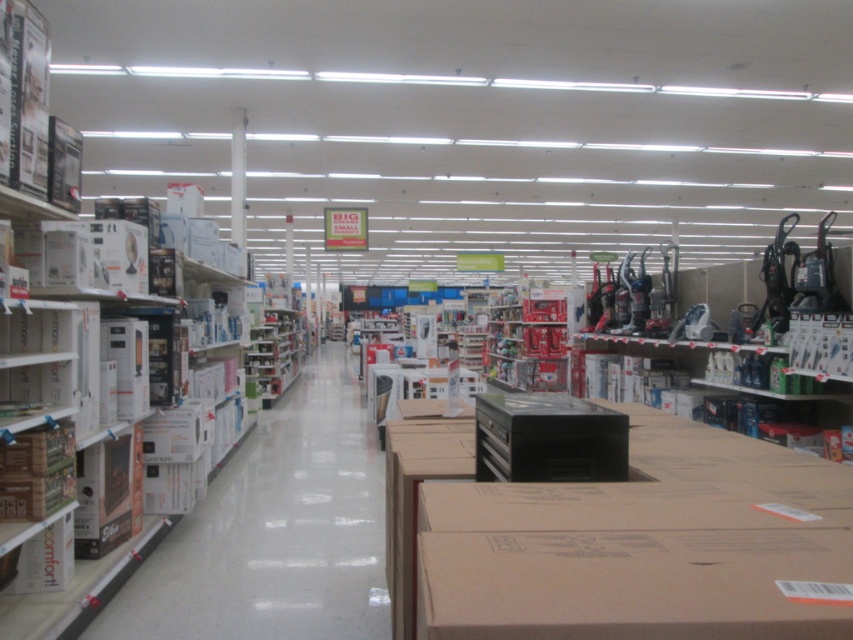
Question: Is brown cardboard box at center above white cardboard boxes at left?

Choices:
 (A) yes
 (B) no

Answer: (A)

Question: Which object appears closest to the camera in this image?

Choices:
 (A) white cardboard boxes at left
 (B) brown cardboard box at center

Answer: (B)

Question: Is brown cardboard box at center behind white cardboard boxes at left?

Choices:
 (A) yes
 (B) no

Answer: (B)

Question: Can you confirm if brown cardboard box at center is smaller than white cardboard boxes at left?

Choices:
 (A) yes
 (B) no

Answer: (A)

Question: Which point is farther from the camera taking this photo?

Choices:
 (A) (106, 627)
 (B) (604, 632)

Answer: (A)